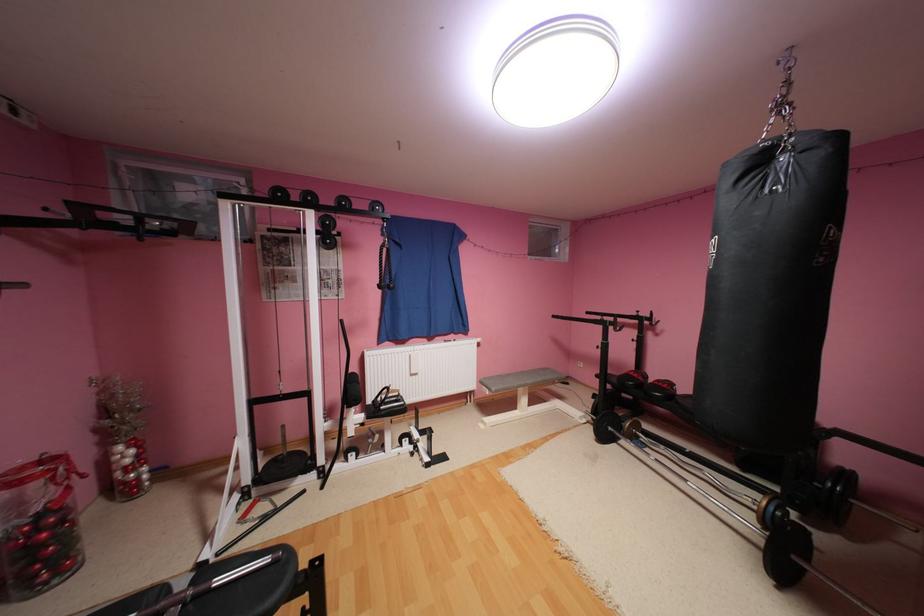
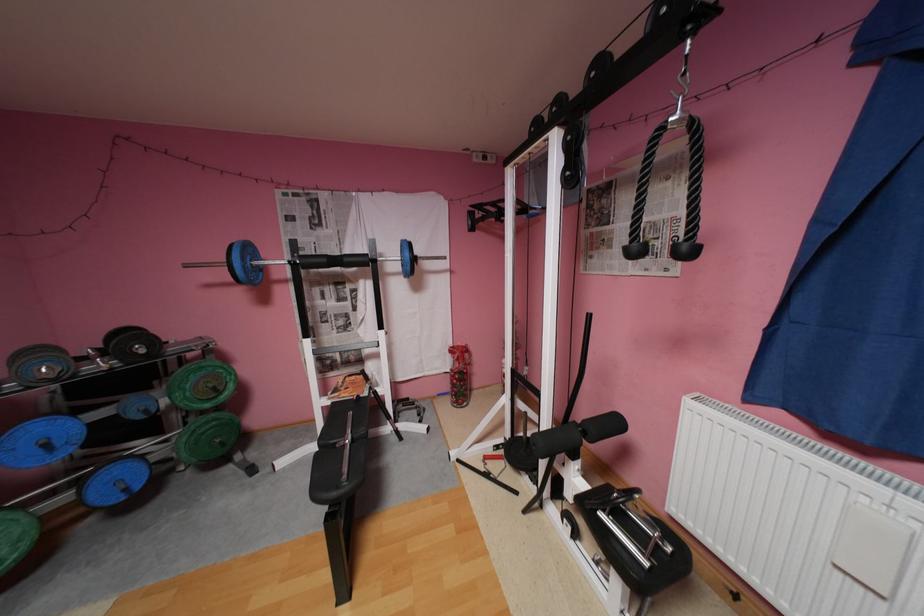
Find the pixel in the second image that matches point (45, 530) in the first image.

(462, 377)